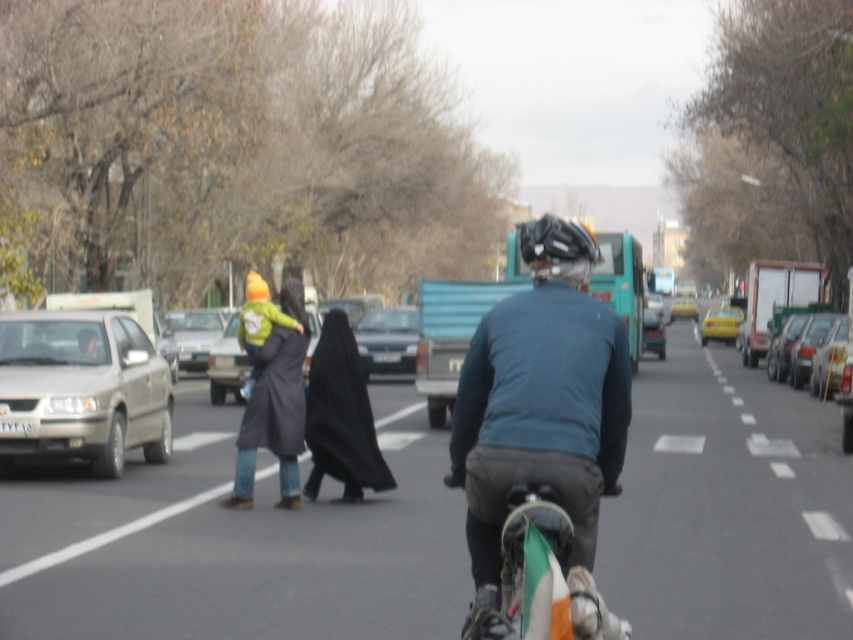
Which is in front, point (509, 403) or point (241, 397)?

Point (509, 403)

Is point (587, 580) more distant than point (221, 346)?

No, it is not.

Image resolution: width=853 pixels, height=640 pixels. Identify the location of teal jersey at center. (543, 413).

The width and height of the screenshot is (853, 640). What do you see at coordinates (273, 401) in the screenshot?
I see `dark blue coat at center` at bounding box center [273, 401].

Can you confirm if dark blue coat at center is positioned above black fabric at center?

Correct, dark blue coat at center is located above black fabric at center.

You are a GUI agent. You are given a task and a screenshot of the screen. Output one action in this format:
    pyautogui.click(x=<x>, y=<y>)
    Task: Click on the dark blue coat at center
    
    Given the screenshot: What is the action you would take?
    pyautogui.click(x=273, y=401)

Is point (235, 314) closer to camera compared to point (694, 307)?

That is True.

Between point (305, 364) and point (672, 310), which one is positioned behind?

The point (672, 310) is behind.

Which is behind, point (311, 326) or point (680, 305)?

The point (680, 305) is behind.

Where is `green matte car at center`? green matte car at center is located at coordinates (227, 364).